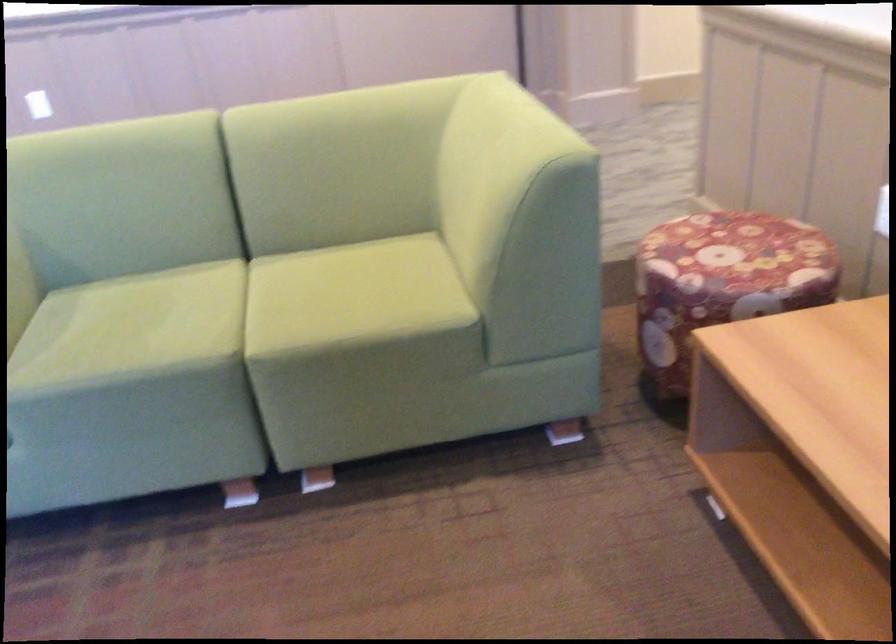
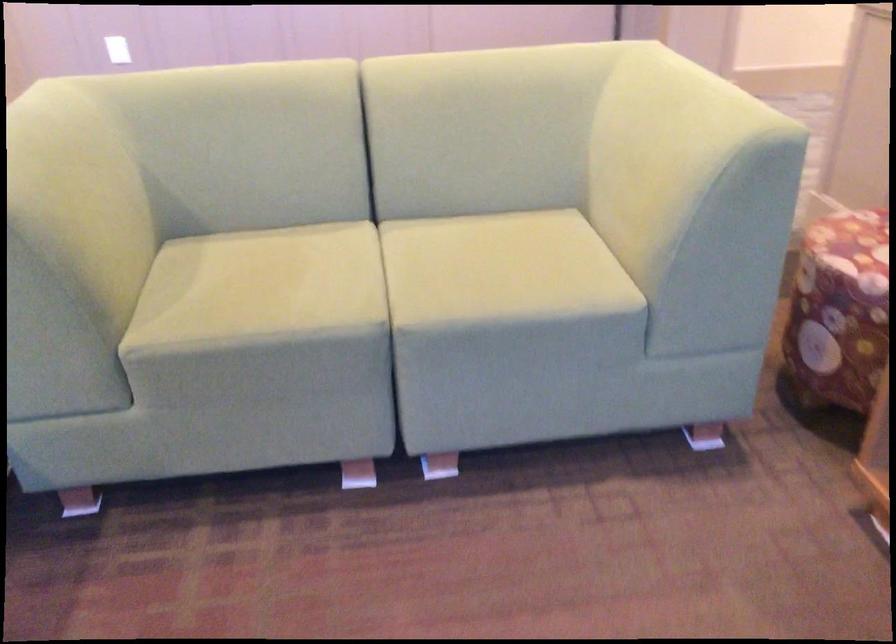
Locate, in the second image, the point that corresponds to (682,234) in the first image.

(851, 231)